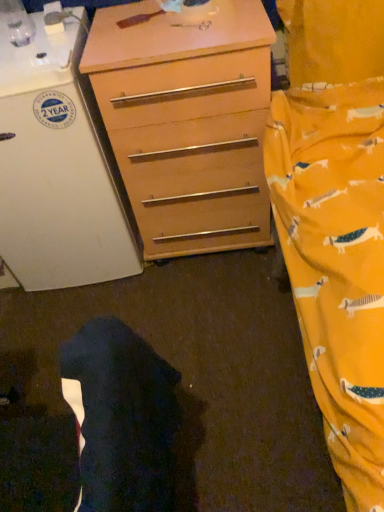
Question: Is white matte refrigerator at left to the left or to the right of wooden chest of drawers at center in the image?

Choices:
 (A) right
 (B) left

Answer: (B)

Question: From the image's perspective, is white matte refrigerator at left positioned above or below wooden chest of drawers at center?

Choices:
 (A) below
 (B) above

Answer: (A)

Question: Estimate the real-world distances between objects in this image. Which object is farther from the white matte refrigerator at left?

Choices:
 (A) dark fabric robe at lower left
 (B) wooden chest of drawers at center

Answer: (A)

Question: Estimate the real-world distances between objects in this image. Which object is farther from the dark fabric robe at lower left?

Choices:
 (A) white matte refrigerator at left
 (B) wooden chest of drawers at center

Answer: (A)